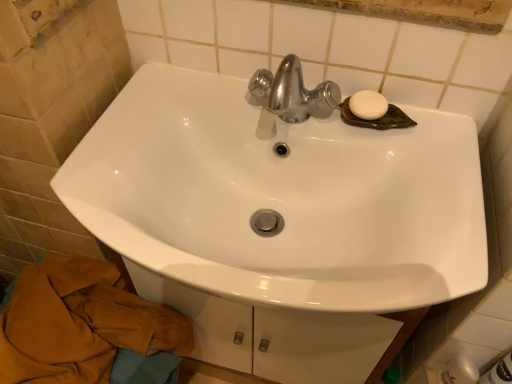
Question: Considering the relative positions of white matte soap at upper right and white glossy sink at center in the image provided, is white matte soap at upper right to the right of white glossy sink at center from the viewer's perspective?

Choices:
 (A) yes
 (B) no

Answer: (A)

Question: Considering the relative sizes of white matte soap at upper right and white glossy sink at center in the image provided, is white matte soap at upper right bigger than white glossy sink at center?

Choices:
 (A) no
 (B) yes

Answer: (A)

Question: Are white matte soap at upper right and white glossy sink at center beside each other?

Choices:
 (A) no
 (B) yes

Answer: (A)

Question: Is white matte soap at upper right oriented away from white glossy sink at center?

Choices:
 (A) no
 (B) yes

Answer: (A)

Question: Is white matte soap at upper right smaller than white glossy sink at center?

Choices:
 (A) yes
 (B) no

Answer: (A)

Question: Is white matte soap at upper right not near white glossy sink at center?

Choices:
 (A) no
 (B) yes

Answer: (A)

Question: Considering the relative sizes of brown cotton bath towel at lower left and white matte soap at upper right in the image provided, is brown cotton bath towel at lower left thinner than white matte soap at upper right?

Choices:
 (A) no
 (B) yes

Answer: (A)

Question: Is brown cotton bath towel at lower left completely or partially outside of white matte soap at upper right?

Choices:
 (A) no
 (B) yes

Answer: (B)

Question: From a real-world perspective, is brown cotton bath towel at lower left positioned under white matte soap at upper right based on gravity?

Choices:
 (A) no
 (B) yes

Answer: (B)

Question: Is brown cotton bath towel at lower left positioned with its back to white matte soap at upper right?

Choices:
 (A) yes
 (B) no

Answer: (B)

Question: From a real-world perspective, is brown cotton bath towel at lower left located higher than white matte soap at upper right?

Choices:
 (A) yes
 (B) no

Answer: (B)

Question: From the image's perspective, is brown cotton bath towel at lower left above white matte soap at upper right?

Choices:
 (A) yes
 (B) no

Answer: (B)

Question: Does brown cotton bath towel at lower left have a larger size compared to white glossy sink at center?

Choices:
 (A) yes
 (B) no

Answer: (B)